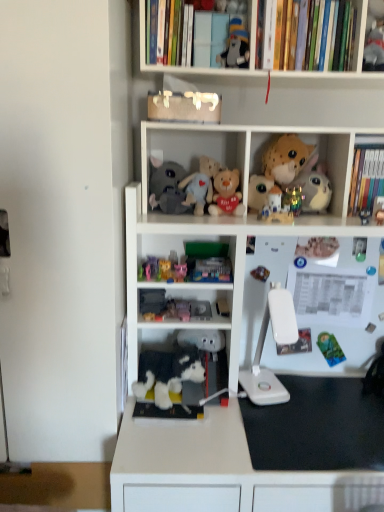
Image resolution: width=384 pixels, height=512 pixels. Find the location of `free space in front of white plastic lamp at lower right`. free space in front of white plastic lamp at lower right is located at coordinates (266, 429).